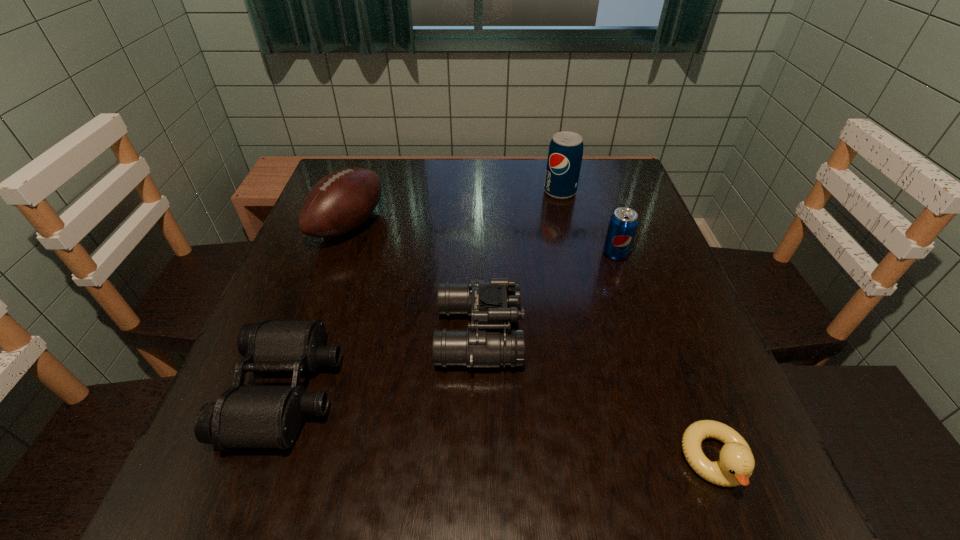
Image resolution: width=960 pixels, height=540 pixels. Identify the location of the farther pop soda. (565, 153).

At what (x,y) coordinates should I click in order to perform the action: click on the third object from right to left. Please return your answer as a coordinate pair (x, y). This screenshot has width=960, height=540. Looking at the image, I should click on (565, 153).

The image size is (960, 540). I want to click on football (American), so click(x=340, y=202).

The width and height of the screenshot is (960, 540). What are the coordinates of `the right pop soda` in the screenshot? It's located at (623, 223).

Find the location of `the shorter pop soda`. the shorter pop soda is located at coordinates (623, 223).

You are a GUI agent. You are given a task and a screenshot of the screen. Output one action in this format:
    pyautogui.click(x=<x>, y=<y>)
    Task: Click on the right binoculars
    This screenshot has width=960, height=540.
    Given the screenshot: What is the action you would take?
    pyautogui.click(x=492, y=304)

Where is `the third object from left to right`? the third object from left to right is located at coordinates (492, 304).

The image size is (960, 540). What are the coordinates of `the left binoculars` in the screenshot? It's located at (244, 416).

Identify the location of duckling. (736, 464).

The width and height of the screenshot is (960, 540). Identify the location of vacant point located 0.150m on the front of the left pop soda. (570, 237).